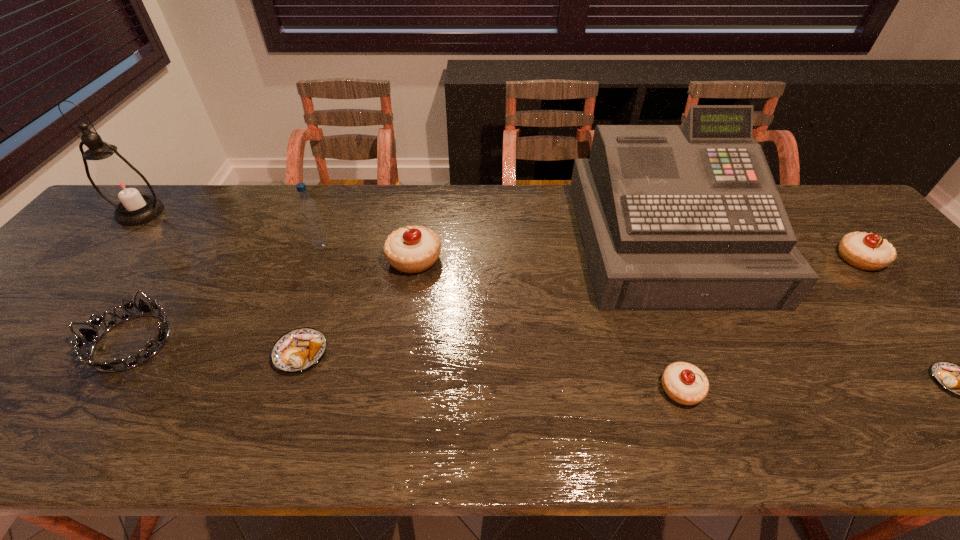
Identify the location of unoccupied area between the second beige pastry from right to left and the blue water bottle. The height and width of the screenshot is (540, 960). (501, 318).

I want to click on vacant area between the second object from left to right and the fourth pastry from right to left, so click(273, 300).

I want to click on free spot between the oil lamp and the leftmost beige pastry, so click(x=277, y=236).

This screenshot has height=540, width=960. I want to click on free spot between the second beige pastry from left to right and the eighth tallest object, so click(491, 371).

At what (x,y) coordinates should I click in order to perform the action: click on empty location between the third shortest pastry and the tiara. Please return your answer as a coordinate pair (x, y). This screenshot has width=960, height=540. Looking at the image, I should click on point(406,366).

Identify the location of free space between the fifth tallest object and the third pastry from right to left. (770, 324).

Locate an element on the screen. the sixth closest object to the tiara is located at coordinates (684, 383).

Locate which object ranks seventh in proximity to the shortest object. Please provide its 2D coordinates. Your answer should be formatted as a tuple, i.e. [(x, y)], where the tuple contains the x and y coordinates of a point satisfying the conditions above.

[(91, 336)]

I want to click on pastry that can be found as the third closest to the water bottle, so click(x=684, y=383).

Identify which pastry is the nearest to the biggest beige pastry. Please provide its 2D coordinates. Your answer should be formatted as a tuple, i.e. [(x, y)], where the tuple contains the x and y coordinates of a point satisfying the conditions above.

[(300, 349)]